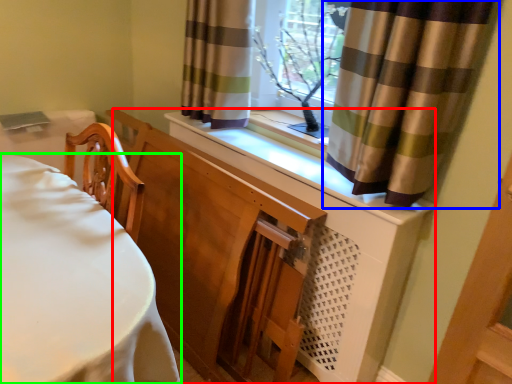
Question: Which object is positioned closest to dresser (highlighted by a red box)? Select from curtain (highlighted by a blue box) and furniture (highlighted by a green box).

Choices:
 (A) curtain
 (B) furniture

Answer: (A)